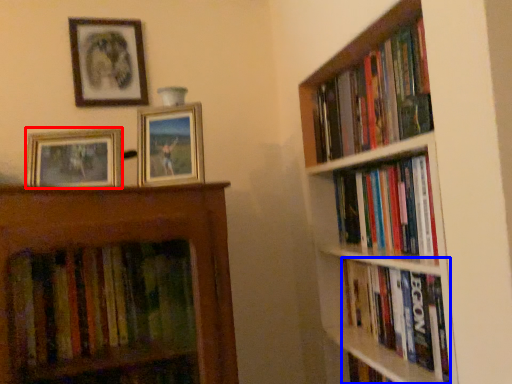
Question: Which object appears closest to the camera in this image, picture frame (highlighted by a red box) or book (highlighted by a blue box)?

Choices:
 (A) picture frame
 (B) book

Answer: (B)